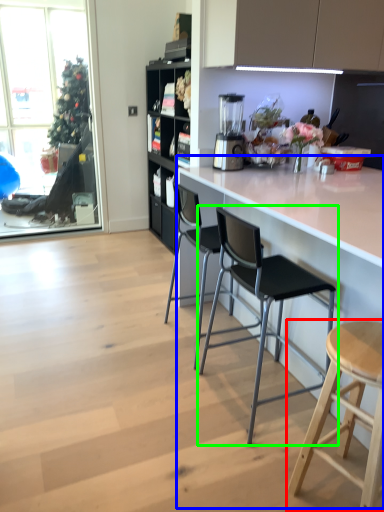
Question: Which object is positioned farthest from stool (highlighted by a red box)? Select from counter (highlighted by a blue box) and chair (highlighted by a green box).

Choices:
 (A) counter
 (B) chair

Answer: (A)